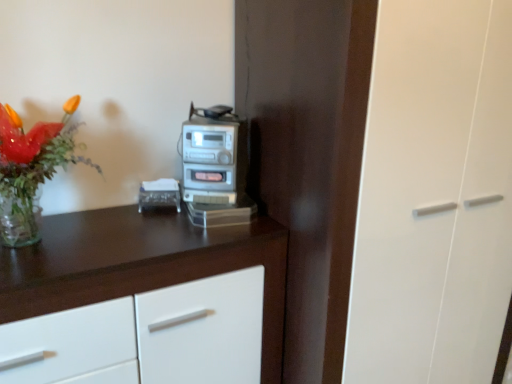
What are the coordinates of `transparent glass door at center` in the screenshot? It's located at (434, 196).

The image size is (512, 384). What are the coordinates of `silver metallic stereo at center` in the screenshot? It's located at (216, 168).

Where is `white glossy cabinet at upper left`? The width and height of the screenshot is (512, 384). white glossy cabinet at upper left is located at coordinates (141, 264).

Is translucent glass vase at upper left looking in the opposite direction of silver metallic stereo at center?

That's not correct — translucent glass vase at upper left is not looking away from silver metallic stereo at center.

Considering the sizes of objects translucent glass vase at upper left and silver metallic stereo at center in the image provided, who is thinner, translucent glass vase at upper left or silver metallic stereo at center?

silver metallic stereo at center.

Who is bigger, translucent glass vase at upper left or silver metallic stereo at center?

With larger size is translucent glass vase at upper left.

Can you tell me how much silver metallic stereo at center and clear plastic tissue box at center differ in facing direction?

The angular difference between silver metallic stereo at center and clear plastic tissue box at center is 12.8 degrees.

Consider the image. Is silver metallic stereo at center inside the boundaries of clear plastic tissue box at center, or outside?

silver metallic stereo at center is outside clear plastic tissue box at center.

Which object is more forward, silver metallic stereo at center or clear plastic tissue box at center?

Positioned in front is silver metallic stereo at center.

Can you see silver metallic stereo at center touching clear plastic tissue box at center?

No, silver metallic stereo at center is not touching clear plastic tissue box at center.

Is translucent glass vase at upper left surrounding white glossy cabinet at upper left?

No, translucent glass vase at upper left does not contain white glossy cabinet at upper left.

Considering the sizes of translucent glass vase at upper left and white glossy cabinet at upper left in the image, is translucent glass vase at upper left bigger or smaller than white glossy cabinet at upper left?

In the image, translucent glass vase at upper left appears to be smaller than white glossy cabinet at upper left.

Between translucent glass vase at upper left and white glossy cabinet at upper left, which one appears on the right side from the viewer's perspective?

From the viewer's perspective, white glossy cabinet at upper left appears more on the right side.

Considering the positions of objects translucent glass vase at upper left and white glossy cabinet at upper left in the image provided, who is behind, translucent glass vase at upper left or white glossy cabinet at upper left?

white glossy cabinet at upper left is behind.

Considering the positions of point (192, 120) and point (472, 257), is point (192, 120) closer or farther from the camera than point (472, 257)?

Point (192, 120) is closer to the camera than point (472, 257).

Where is `glass door in front of the silver metallic stereo at center`? The image size is (512, 384). glass door in front of the silver metallic stereo at center is located at coordinates (434, 196).

Can you confirm if silver metallic stereo at center is positioned to the left of transparent glass door at center?

Correct, you'll find silver metallic stereo at center to the left of transparent glass door at center.

Who is taller, silver metallic stereo at center or translucent glass vase at upper left?

translucent glass vase at upper left is taller.

Relative to translucent glass vase at upper left, is silver metallic stereo at center in front or behind?

silver metallic stereo at center is behind translucent glass vase at upper left.

Is silver metallic stereo at center bigger than translucent glass vase at upper left?

No, silver metallic stereo at center is not bigger than translucent glass vase at upper left.

Is clear plastic tissue box at center bigger than silver metallic stereo at center?

Actually, clear plastic tissue box at center might be smaller than silver metallic stereo at center.

Would you say clear plastic tissue box at center is inside or outside silver metallic stereo at center?

clear plastic tissue box at center is not enclosed by silver metallic stereo at center.

Is clear plastic tissue box at center next to silver metallic stereo at center and touching it?

No, clear plastic tissue box at center is not with silver metallic stereo at center.

Is clear plastic tissue box at center in front of or behind silver metallic stereo at center in the image?

Visually, clear plastic tissue box at center is located behind silver metallic stereo at center.

Considering the sizes of objects translucent glass vase at upper left and transparent glass door at center in the image provided, who is thinner, translucent glass vase at upper left or transparent glass door at center?

translucent glass vase at upper left is thinner.

The width and height of the screenshot is (512, 384). I want to click on glass door directly beneath the translucent glass vase at upper left (from a real-world perspective), so click(434, 196).

Does point (24, 183) come in front of point (398, 60)?

No, it is behind (398, 60).

Find the location of a particular element. The width and height of the screenshot is (512, 384). houseplant above the silver metallic stereo at center (from a real-world perspective) is located at coordinates (31, 169).

You are a GUI agent. You are given a task and a screenshot of the screen. Output one action in this format:
    pyautogui.click(x=<x>, y=<y>)
    Task: Click on the home appliance above the clear plastic tissue box at center (from the image's perspective)
    The image size is (512, 384).
    Given the screenshot: What is the action you would take?
    pyautogui.click(x=216, y=168)

From the image, which object appears to be nearer to white glossy cabinet at upper left, translucent glass vase at upper left or clear plastic tissue box at center?

clear plastic tissue box at center.

From the image, which object appears to be nearer to clear plastic tissue box at center, white glossy cabinet at upper left or transparent glass door at center?

white glossy cabinet at upper left is closer to clear plastic tissue box at center.

From the image, which object appears to be farther from translucent glass vase at upper left, transparent glass door at center or white glossy cabinet at upper left?

Based on the image, transparent glass door at center appears to be further to translucent glass vase at upper left.

From the image, which object appears to be nearer to translucent glass vase at upper left, silver metallic stereo at center or white glossy cabinet at upper left?

The object closer to translucent glass vase at upper left is white glossy cabinet at upper left.

Considering their positions, is white glossy cabinet at upper left positioned further to clear plastic tissue box at center than silver metallic stereo at center?

white glossy cabinet at upper left is positioned further to the anchor clear plastic tissue box at center.

Which object lies further to the anchor point white glossy cabinet at upper left, silver metallic stereo at center or clear plastic tissue box at center?

clear plastic tissue box at center.

Based on their spatial positions, is white glossy cabinet at upper left or clear plastic tissue box at center closer to silver metallic stereo at center?

The object closer to silver metallic stereo at center is clear plastic tissue box at center.

Based on their spatial positions, is clear plastic tissue box at center or transparent glass door at center further from white glossy cabinet at upper left?

transparent glass door at center lies further to white glossy cabinet at upper left than the other object.

This screenshot has width=512, height=384. In order to click on home appliance between clear plastic tissue box at center and transparent glass door at center in this screenshot , I will do `click(216, 168)`.

At what (x,y) coordinates should I click in order to perform the action: click on appliance situated between translucent glass vase at upper left and transparent glass door at center from left to right. Please return your answer as a coordinate pair (x, y). This screenshot has height=384, width=512. Looking at the image, I should click on coord(159,194).

Find the location of a particular element. home appliance situated between white glossy cabinet at upper left and transparent glass door at center from left to right is located at coordinates (216, 168).

Locate an element on the screen. This screenshot has height=384, width=512. appliance between translucent glass vase at upper left and white glossy cabinet at upper left in the up-down direction is located at coordinates (159, 194).